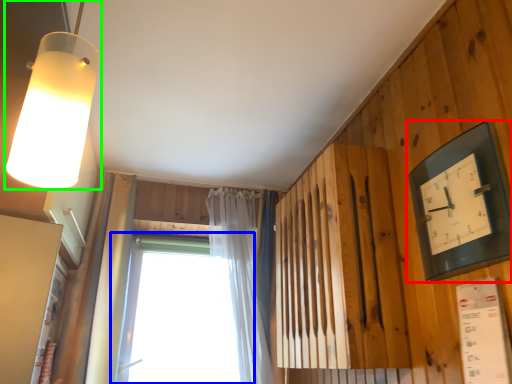
Question: Which is farther away from clock (highlighted by a red box)? window (highlighted by a blue box) or lamp (highlighted by a green box)?

Choices:
 (A) window
 (B) lamp

Answer: (A)